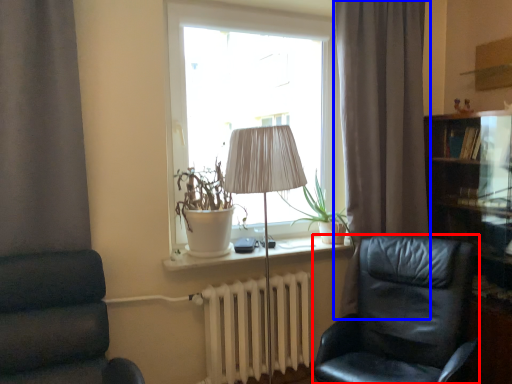
Question: Which object is further to the camera taking this photo, chair (highlighted by a red box) or curtain (highlighted by a blue box)?

Choices:
 (A) chair
 (B) curtain

Answer: (B)